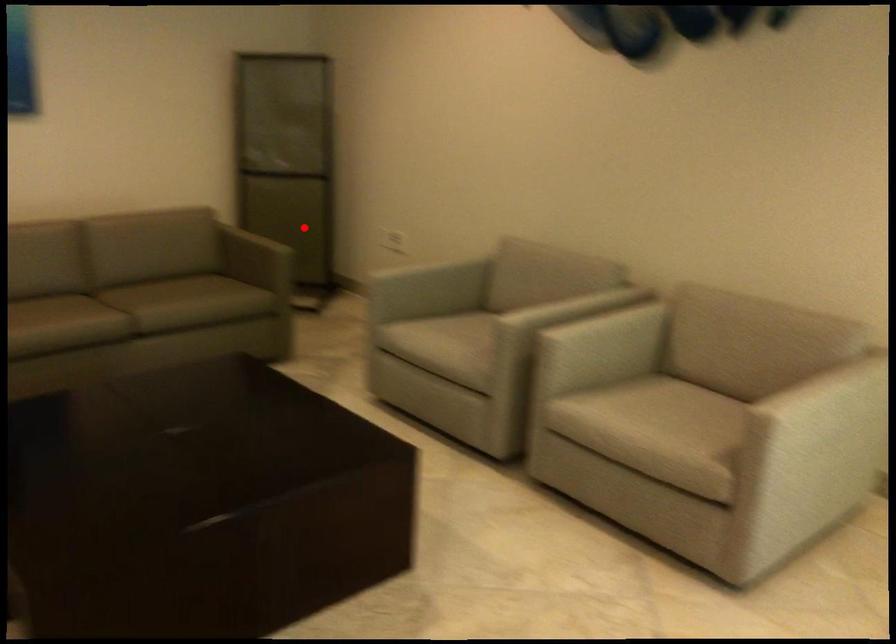
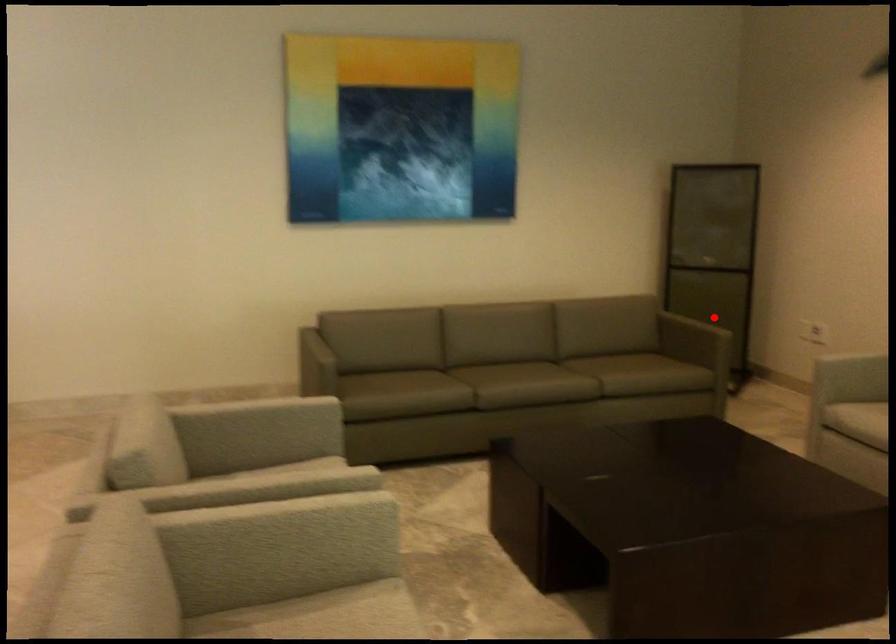
I am providing you with two images of the same scene from different viewpoints. A red point is marked on the first image and another point is marked on the second image. Is the red point in image1 aligned with the point shown in image2?

Yes